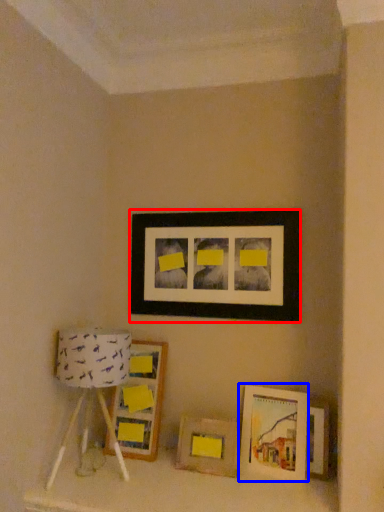
Question: Which object appears farthest to the camera in this image, picture frame (highlighted by a red box) or picture frame (highlighted by a blue box)?

Choices:
 (A) picture frame
 (B) picture frame

Answer: (A)